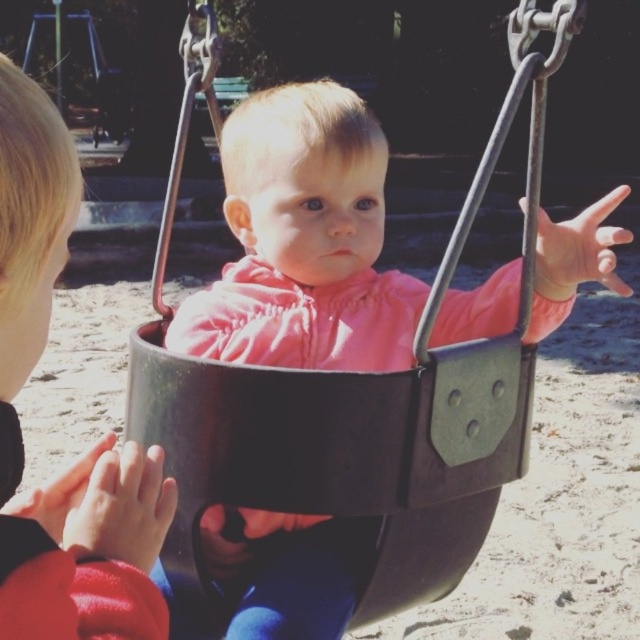
Which is more to the left, black matte swing at center or matte black swing at center?

matte black swing at center is more to the left.

Between black matte swing at center and matte black swing at center, which one is positioned lower?

Positioned lower is matte black swing at center.

Image resolution: width=640 pixels, height=640 pixels. I want to click on black matte swing at center, so click(365, 412).

Locate an element on the screen. Image resolution: width=640 pixels, height=640 pixels. black matte swing at center is located at coordinates (365, 412).